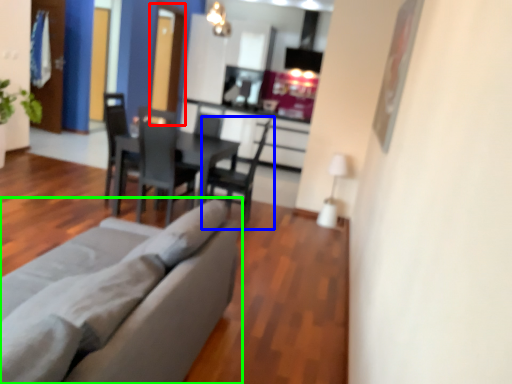
Question: Estimate the real-world distances between objects in this image. Which object is farther from glass door (highlighted by a red box), chair (highlighted by a blue box) or studio couch (highlighted by a green box)?

Choices:
 (A) chair
 (B) studio couch

Answer: (B)